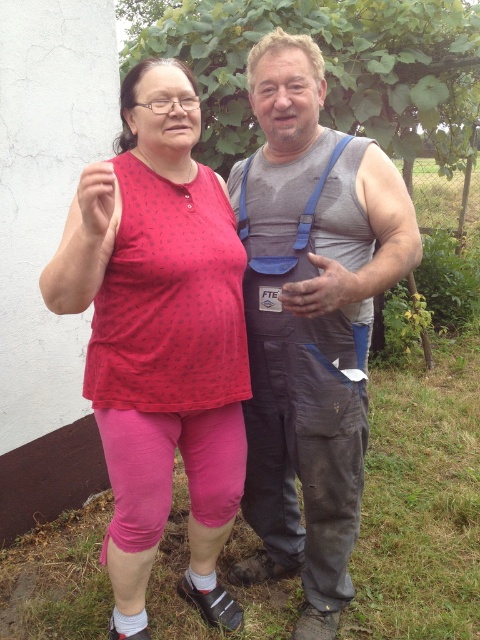
Between matte pink leggings at left and gray fabric tank top at center, which one appears on the left side from the viewer's perspective?

matte pink leggings at left

Locate an element on the screen. The image size is (480, 640). matte pink leggings at left is located at coordinates (159, 333).

Find the location of a particular element. matte pink leggings at left is located at coordinates (159, 333).

Locate an element on the screen. matte pink leggings at left is located at coordinates (159, 333).